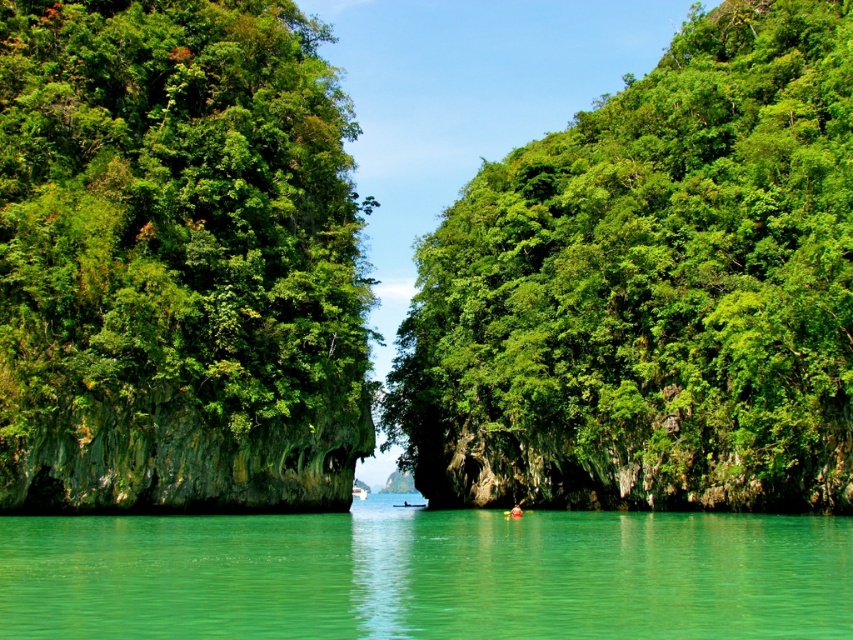
Based on the photo, you are standing at the edge of the turquoise water and want to reach the point marked as point (259, 36). Which direction should you move relative to the point marked as point (740, 1)?

Since point (740, 1) is closer to you than point (259, 36), you should move away from point (740, 1) to reach point (259, 36).

You are standing at the edge of the water and want to take a photo of both the green leafy tree at left and the clear water at center. Which object should you position closer to the camera to ensure both are in focus?

Since the green leafy tree at left is taller than clear water at center, you should position the green leafy tree at left closer to the camera to ensure both are in focus.

You are standing at the edge of the turquoise water and want to walk towards the point marked as point (734, 628). Which direction should you move relative to the point marked as point (838, 125)?

You should move away from the point marked as point (838, 125) because point (734, 628) is closer to the camera than point (838, 125).